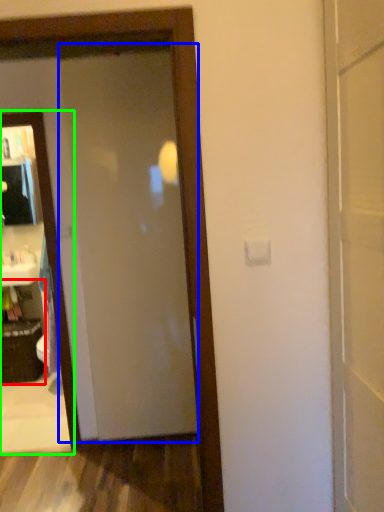
Question: Based on their relative distances, which object is farther from cabinetry (highlighted by a red box)? Choose from door (highlighted by a blue box) and mirror (highlighted by a green box).

Choices:
 (A) door
 (B) mirror

Answer: (A)